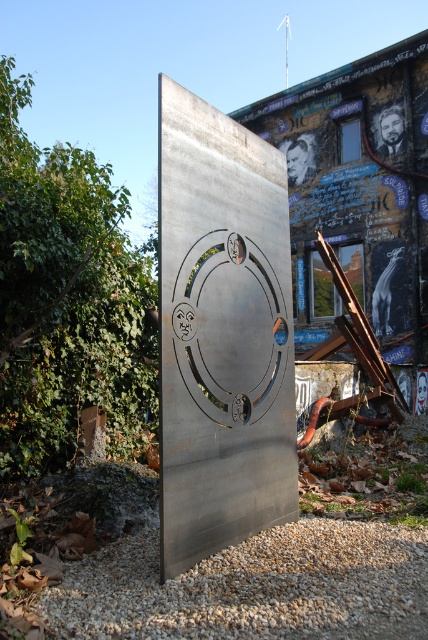
In the scene shown: You are an artist planning to install a new sculpture in the outdoor space shown. You have a small statue that is 1 meter tall. You want to place it between the metallic silver circle at center and the gray gravel at lower center. Considering their heights, where should you place the statue so it doesn

The metallic silver circle at center is much taller than the gray gravel at lower center. Since your statue is 1 meter tall, you should place it near the gray gravel at lower center to maintain visual balance, as the statue